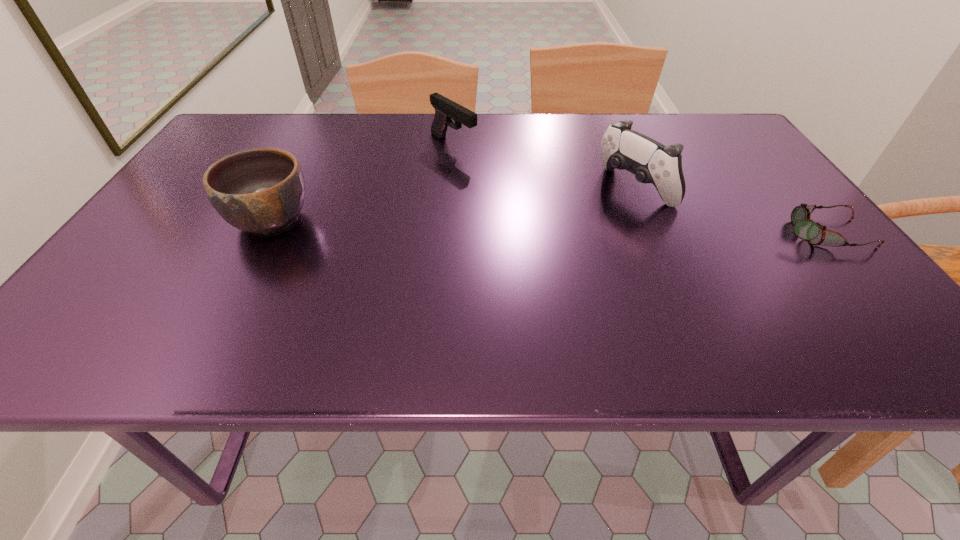
Where is `free space on the desktop that is between the leftmost object and the shortest object and is positioned on the front-facing side of the control`? Image resolution: width=960 pixels, height=540 pixels. free space on the desktop that is between the leftmost object and the shortest object and is positioned on the front-facing side of the control is located at coordinates (564, 227).

At what (x,y) coordinates should I click in order to perform the action: click on vacant spot on the desktop that is between the leftmost object and the shortest object and is positioned on the front-facing side of the farthest object. Please return your answer as a coordinate pair (x, y). Looking at the image, I should click on (588, 227).